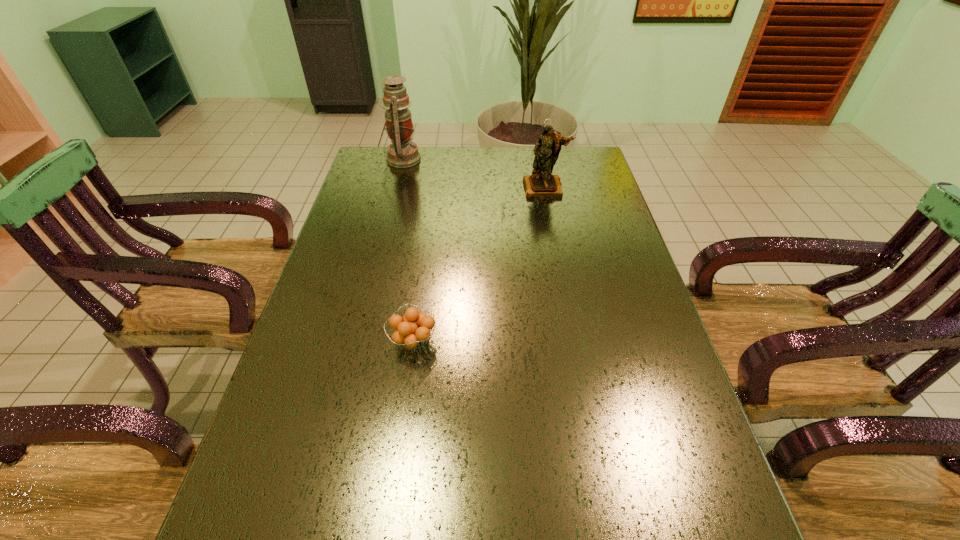
The height and width of the screenshot is (540, 960). Find the location of `figurine that is at the far edge`. figurine that is at the far edge is located at coordinates (541, 184).

Identify the location of object positioned at the left edge. This screenshot has height=540, width=960. (402, 153).

Locate an element on the screen. object that is at the right edge is located at coordinates (541, 184).

Find the location of `object that is at the far left corner`. object that is at the far left corner is located at coordinates (402, 153).

Where is `object that is positioned at the far right corner`? The height and width of the screenshot is (540, 960). object that is positioned at the far right corner is located at coordinates (541, 184).

I want to click on vacant space at the far edge of the desktop, so click(524, 164).

The image size is (960, 540). Find the location of `vacant space at the left edge`. vacant space at the left edge is located at coordinates (321, 529).

The image size is (960, 540). I want to click on free point at the right edge, so click(612, 218).

Identify the location of free region at the far left corner. This screenshot has height=540, width=960. (378, 151).

Locate an element on the screen. This screenshot has height=540, width=960. free spot between the rightmost object and the nearest object is located at coordinates (479, 265).